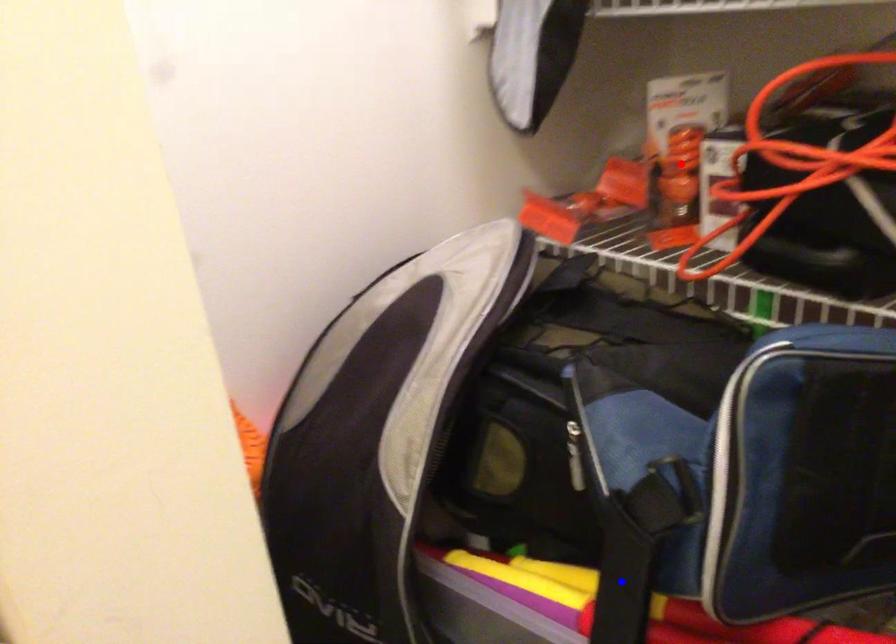
Question: Two points are marked on the image. Which point is closer to the camera?

Choices:
 (A) Blue point is closer.
 (B) Red point is closer.

Answer: (A)